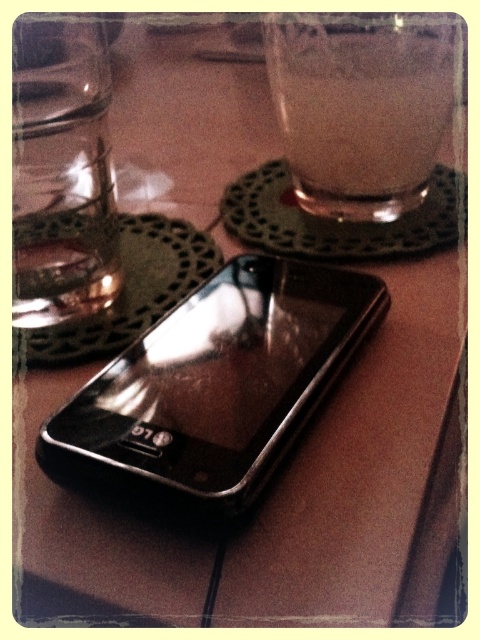
In the scene shown: You are a delivery person who needs to place a package on the table. The package is 6 inches long. There is a black glossy smartphone at center and a transparent glass at upper center on the table. Can you fit the package between them without moving the existing items?

The black glossy smartphone at center and transparent glass at upper center are 5.58 inches apart. Since the package is 6 inches long, it cannot fit between them as the space is slightly smaller than the package.

You are setting up a table for a meeting and need to place the black glossy smartphone at center and the transparent glass at upper center. According to the scene, where should the smartphone be placed relative to the transparent glass?

The black glossy smartphone at center should be placed on the left side of the transparent glass at upper center as described in the scene.

You are setting up a small tray for a tea ceremony. You have a black glossy smartphone at center and a transparent glass at upper center. Which object should you place first to ensure stability?

The black glossy smartphone at center should be placed first because it has a larger size compared to the transparent glass at upper center, providing a stable base.